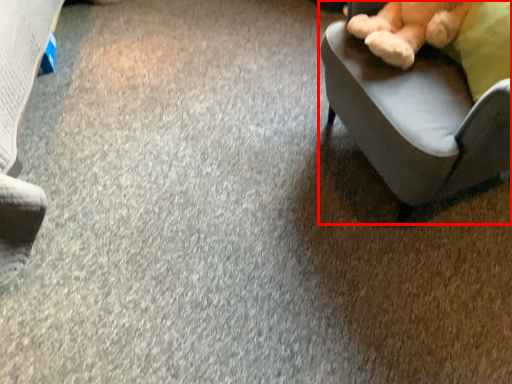
Question: From the image's perspective, what is the correct spatial relationship of chair (annotated by the red box) in relation to teddy bear?

Choices:
 (A) below
 (B) above

Answer: (A)